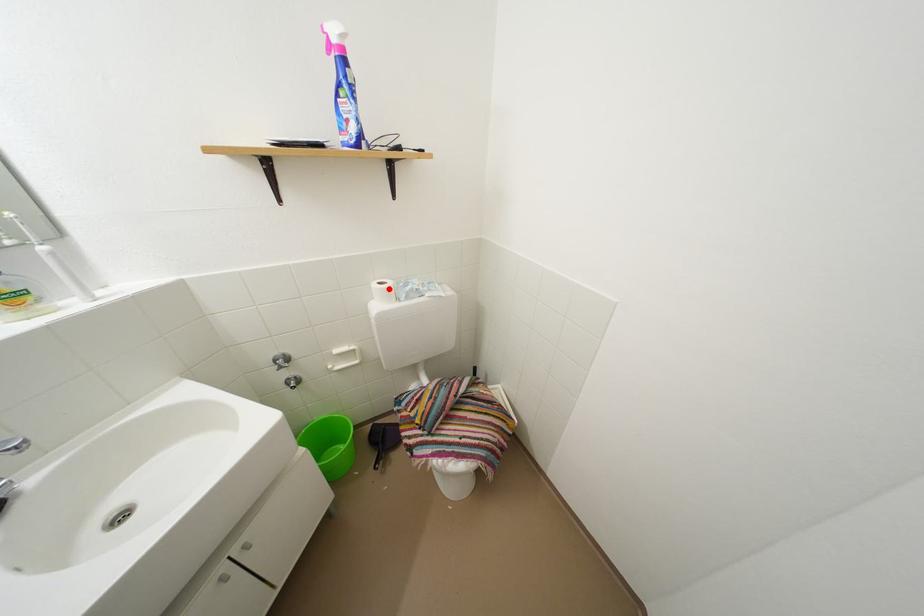
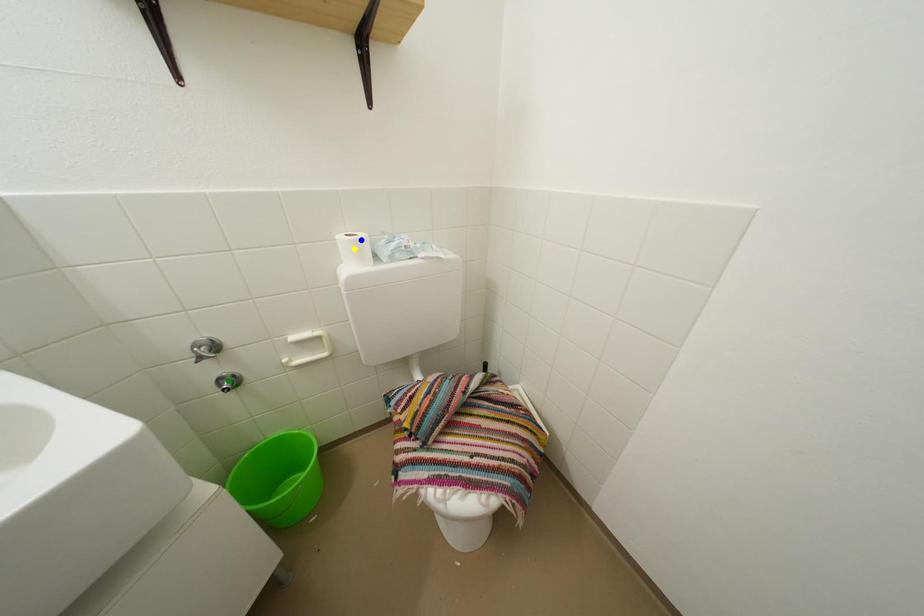
Question: I am providing you with two images of the same scene from different viewpoints. A red point is marked on the first image. You are given multiple points on the second image. Can you choose the point in image 2 that corresponds to the point in image 1?

Choices:
 (A) yellow point
 (B) blue point
 (C) green point

Answer: (B)